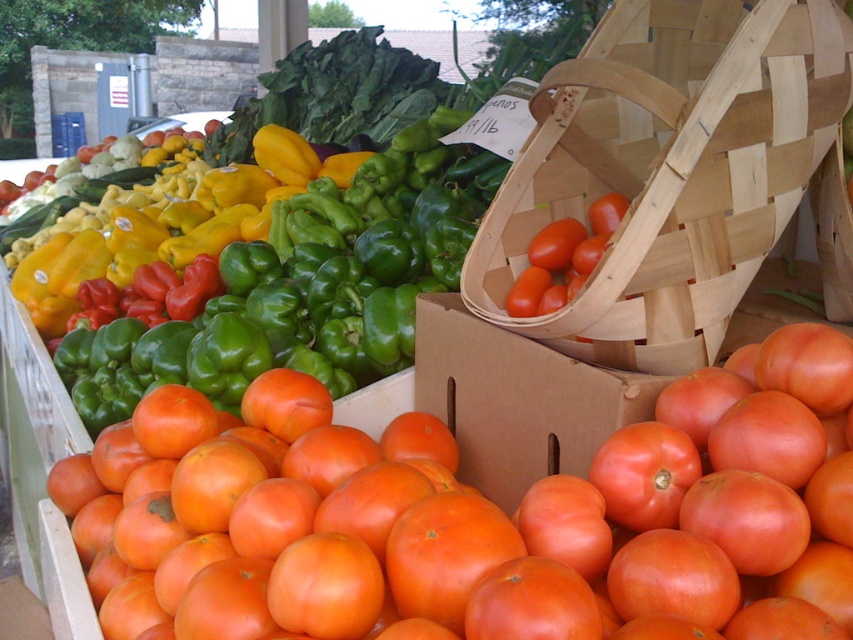
Between wooden woven basket at upper center and cardboard box at right, which one is positioned lower?

cardboard box at right is below.

Does wooden woven basket at upper center appear on the left side of cardboard box at right?

No, wooden woven basket at upper center is not to the left of cardboard box at right.

Which is in front, point (616, 77) or point (460, 458)?

Point (616, 77)

At what (x,y) coordinates should I click in order to perform the action: click on wooden woven basket at upper center. Please return your answer as a coordinate pair (x, y). Looking at the image, I should click on (675, 173).

This screenshot has width=853, height=640. What do you see at coordinates (675, 173) in the screenshot?
I see `wooden woven basket at upper center` at bounding box center [675, 173].

Does wooden woven basket at upper center come behind green matte bell pepper at center?

No, wooden woven basket at upper center is in front of green matte bell pepper at center.

Is point (558, 84) farther from viewer compared to point (84, 205)?

No, (558, 84) is closer to viewer.

Where is `wooden woven basket at upper center`? This screenshot has height=640, width=853. wooden woven basket at upper center is located at coordinates (675, 173).

Does smooth orange tomato at center have a lesser height compared to green matte bell pepper at center?

Yes.

Which of these two, smooth orange tomato at center or green matte bell pepper at center, stands shorter?

With less height is smooth orange tomato at center.

Which is in front, point (187, 593) or point (451, 248)?

Point (187, 593) is in front.

Identify the location of smooth orange tomato at center. The image size is (853, 640). (485, 520).